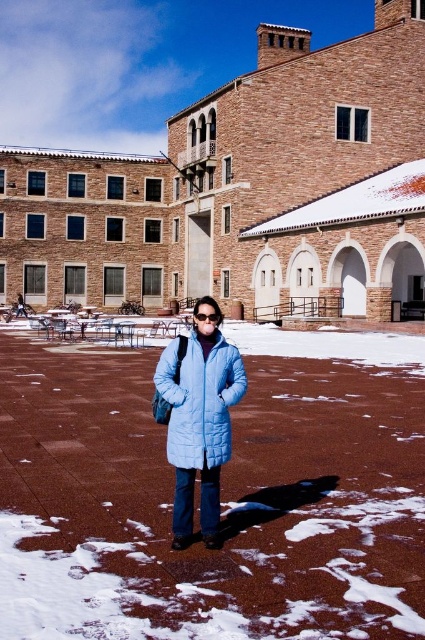
Question: Can you confirm if light blue quilted jacket at center is positioned to the right of transparent plastic goggles at center?

Choices:
 (A) no
 (B) yes

Answer: (A)

Question: Does light blue quilted jacket at center appear on the right side of transparent plastic goggles at center?

Choices:
 (A) no
 (B) yes

Answer: (A)

Question: Is light blue quilted jacket at center thinner than transparent plastic goggles at center?

Choices:
 (A) yes
 (B) no

Answer: (B)

Question: Among these points, which one is farthest from the camera?

Choices:
 (A) (173, 364)
 (B) (200, 320)

Answer: (B)

Question: Which object appears farthest from the camera in this image?

Choices:
 (A) transparent plastic goggles at center
 (B) light blue quilted jacket at center

Answer: (A)

Question: Among these objects, which one is farthest from the camera?

Choices:
 (A) transparent plastic goggles at center
 (B) light blue quilted jacket at center

Answer: (A)